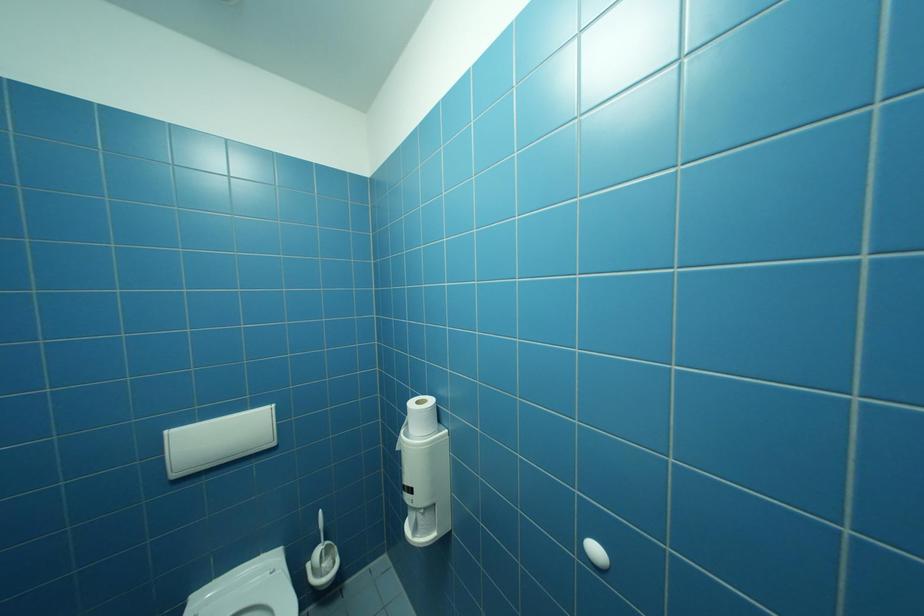
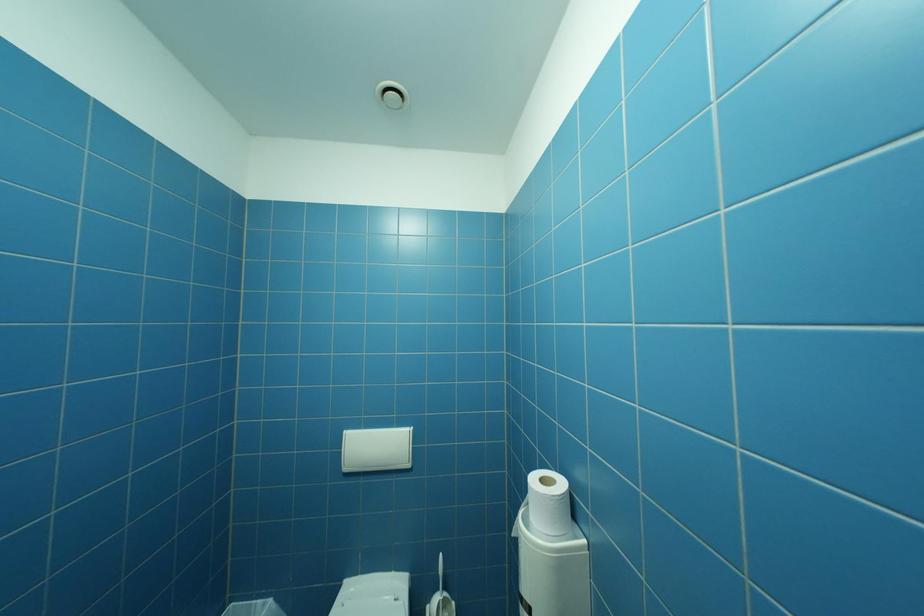
Question: The camera is either moving clockwise (left) or counter-clockwise (right) around the object. The first image is from the beginning of the video and the second image is from the end. Is the camera moving left or right when shooting the video?

Choices:
 (A) Left
 (B) Right

Answer: (B)